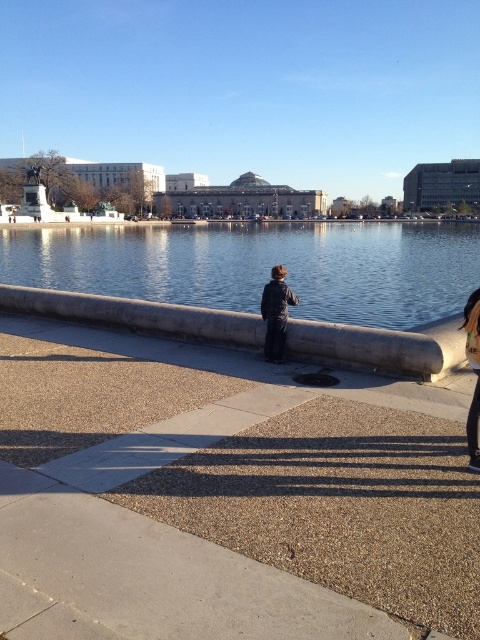
Who is lower down, clear water at center or matte black jacket at center?

Positioned lower is matte black jacket at center.

Between clear water at center and matte black jacket at center, which one appears on the right side from the viewer's perspective?

From the viewer's perspective, matte black jacket at center appears more on the right side.

Is point (443, 298) farther from camera compared to point (468, 440)?

Yes, it is.

In order to click on clear water at center in this screenshot , I will do `click(261, 266)`.

Who is positioned more to the right, gray concrete pavement at center or dark blue jeans at center?

Positioned to the right is dark blue jeans at center.

Locate an element on the screen. This screenshot has width=480, height=640. gray concrete pavement at center is located at coordinates (226, 496).

Is point (56, 358) positioned before point (282, 296)?

No.

Where is `gray concrete pavement at center`? The height and width of the screenshot is (640, 480). gray concrete pavement at center is located at coordinates (226, 496).

Does gray concrete pavement at center lie behind clear water at center?

No, gray concrete pavement at center is in front of clear water at center.

In order to click on gray concrete pavement at center in this screenshot , I will do `click(226, 496)`.

Is point (237, 440) positioned behind point (84, 282)?

No, (237, 440) is in front of (84, 282).

Locate an element on the screen. gray concrete pavement at center is located at coordinates (226, 496).